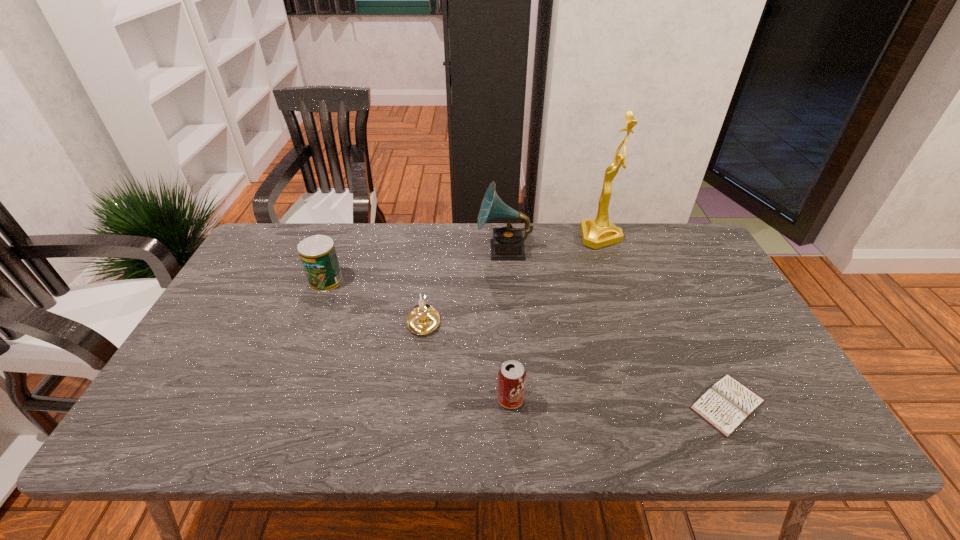
Locate an element on the screen. award situated at the far edge is located at coordinates (599, 232).

Locate an element on the screen. This screenshot has height=540, width=960. phonograph_record located in the far edge section of the desktop is located at coordinates (508, 243).

The width and height of the screenshot is (960, 540). What are the coordinates of `soda can at the near edge` in the screenshot? It's located at (511, 376).

Locate an element on the screen. This screenshot has height=540, width=960. diary that is at the near edge is located at coordinates (727, 404).

The width and height of the screenshot is (960, 540). In order to click on object that is at the right edge in this screenshot , I will do `click(727, 404)`.

The height and width of the screenshot is (540, 960). In order to click on object that is at the near right corner in this screenshot , I will do `click(727, 404)`.

I want to click on vacant position at the far edge of the desktop, so click(373, 261).

Locate an element on the screen. free space at the left edge is located at coordinates (226, 294).

This screenshot has width=960, height=540. In order to click on vacant region at the right edge in this screenshot , I will do `click(721, 294)`.

In the image, there is a desktop. Where is `vacant area at the far right corner`? The height and width of the screenshot is (540, 960). vacant area at the far right corner is located at coordinates (685, 244).